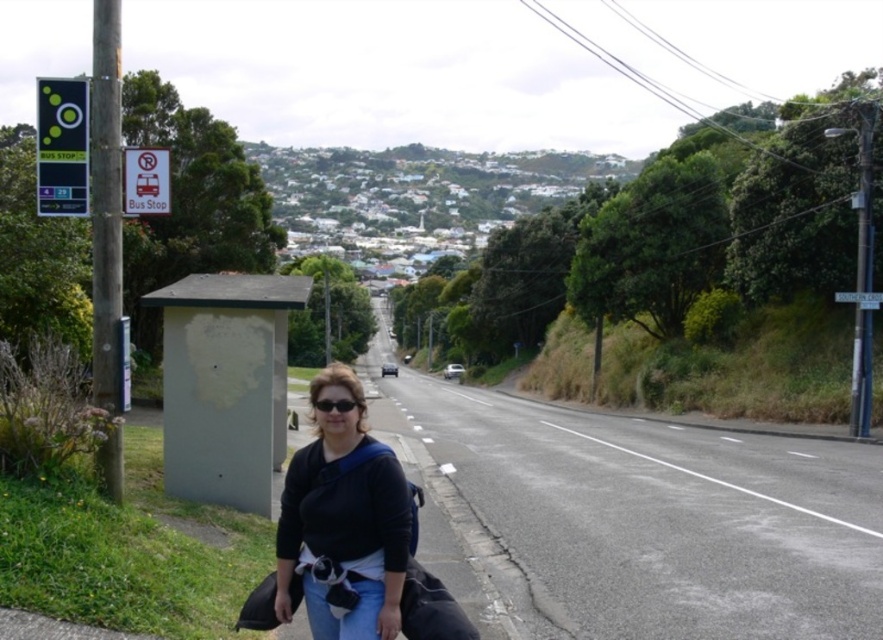
Between point (375, 568) and point (79, 102), which one is positioned behind?

The point (79, 102) is more distant.

Who is positioned more to the right, black fabric bag at center or green plastic bus stop sign at upper left?

From the viewer's perspective, black fabric bag at center appears more on the right side.

Between point (406, 544) and point (48, 208), which one is positioned in front?

Positioned in front is point (406, 544).

You are a GUI agent. You are given a task and a screenshot of the screen. Output one action in this format:
    pyautogui.click(x=<x>, y=<y>)
    Task: Click on the black fabric bag at center
    The height and width of the screenshot is (640, 883).
    Given the screenshot: What is the action you would take?
    pyautogui.click(x=344, y=518)

Is black fabric bag at center to the left of black matte sunglasses at center from the viewer's perspective?

Indeed, black fabric bag at center is positioned on the left side of black matte sunglasses at center.

Does black fabric bag at center have a smaller size compared to black matte sunglasses at center?

Incorrect, black fabric bag at center is not smaller in size than black matte sunglasses at center.

Is point (338, 502) farther from viewer compared to point (338, 412)?

That is False.

This screenshot has width=883, height=640. I want to click on black fabric bag at center, so click(x=344, y=518).

Measure the distance from black fabric bag at center to metallic bus stop sign at left.

2.61 meters

Is point (380, 456) positioned after point (168, 209)?

No, (380, 456) is in front of (168, 209).

Who is more forward, (348,381) or (127,209)?

Point (348,381)

What are the coordinates of `black fabric bag at center` in the screenshot? It's located at (344, 518).